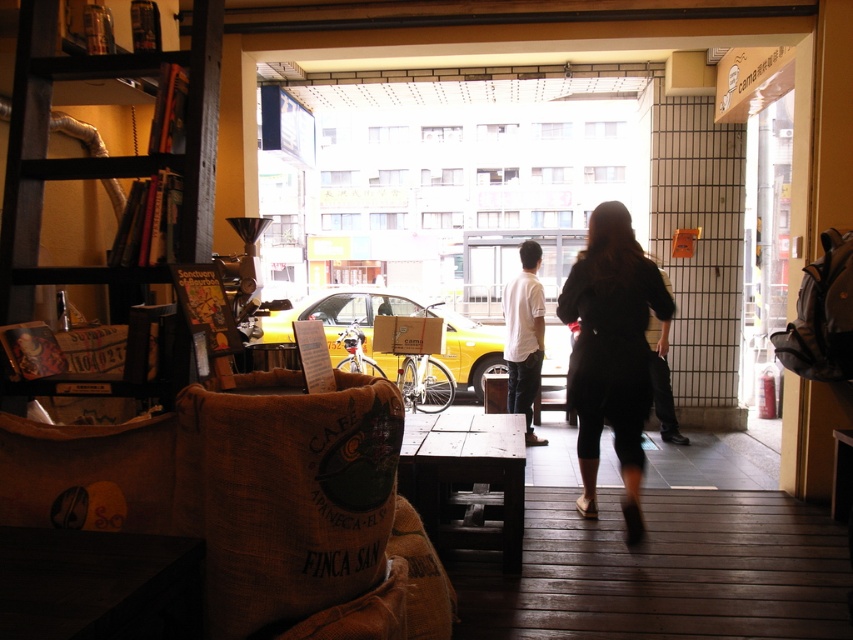
Where is `black wood bookshelf at left`? This screenshot has height=640, width=853. black wood bookshelf at left is located at coordinates (100, 157).

Which is behind, point (167, 163) or point (469, 326)?

Point (469, 326)

Measure the distance between point [143,65] and camera.

A distance of 6.73 feet exists between point [143,65] and camera.

You are a GUI agent. You are given a task and a screenshot of the screen. Output one action in this format:
    pyautogui.click(x=<x>, y=<y>)
    Task: Click on the black wood bookshelf at left
    This screenshot has height=640, width=853.
    Given the screenshot: What is the action you would take?
    pyautogui.click(x=100, y=157)

Which is in front, point (103, 278) or point (518, 378)?

Positioned in front is point (103, 278).

Locate an element on the screen. The height and width of the screenshot is (640, 853). black wood bookshelf at left is located at coordinates (100, 157).

In the scene shown: Does burlap sack at center have a smaller size compared to yellow matte taxi at center?

Yes, burlap sack at center is smaller than yellow matte taxi at center.

Is burlap sack at center bigger than yellow matte taxi at center?

No.

In the scene shown: Who is more forward, (177, 452) or (483, 348)?

Point (177, 452) is more forward.

Find the location of a particular element. The image size is (853, 640). burlap sack at center is located at coordinates (286, 493).